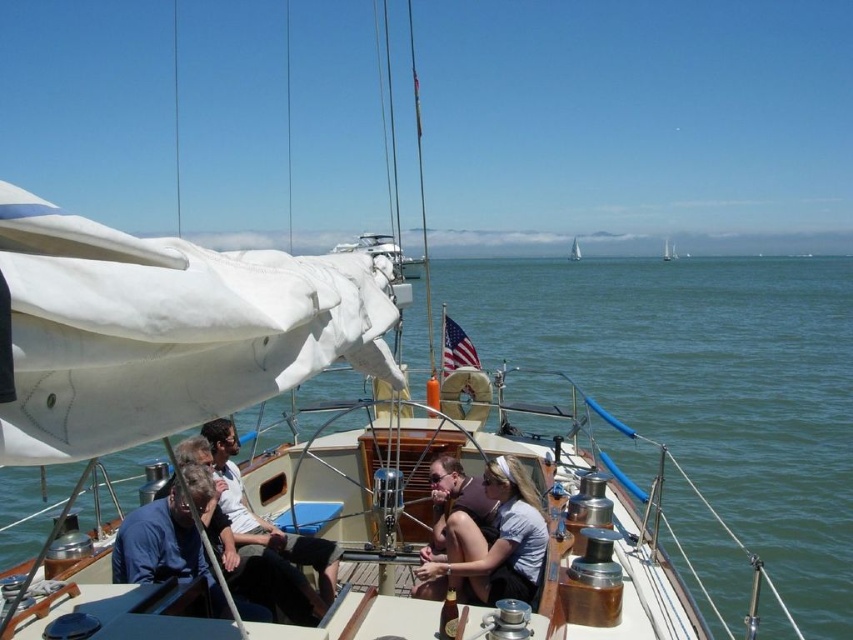
Between white matte sailboat at center and white canvas sailboat at center, which one is positioned lower?

white canvas sailboat at center

Who is shorter, white matte sailboat at center or white canvas sailboat at center?

white canvas sailboat at center

Does point (576, 241) come in front of point (662, 259)?

No.

I want to click on white matte sailboat at center, so click(x=573, y=250).

Does point (316, 550) come closer to viewer compared to point (575, 259)?

Yes, it is in front of point (575, 259).

This screenshot has width=853, height=640. What do you see at coordinates (268, 524) in the screenshot?
I see `white cotton shirt at center` at bounding box center [268, 524].

Identify the location of white cotton shirt at center. pyautogui.click(x=268, y=524).

Can you confirm if blue fabric shirt at lower left is bigger than white canvas sailboat at center?

No, blue fabric shirt at lower left is not bigger than white canvas sailboat at center.

Identify the location of blue fabric shirt at lower left. (164, 547).

Is point (149, 508) positioned in front of point (666, 252)?

Yes, it is.

Find the location of a particular element. blue fabric shirt at lower left is located at coordinates (164, 547).